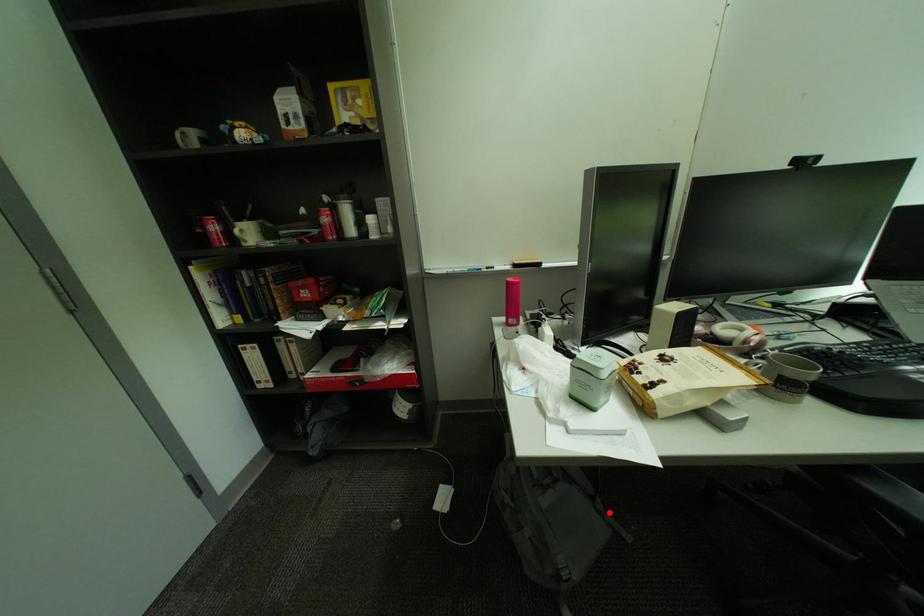
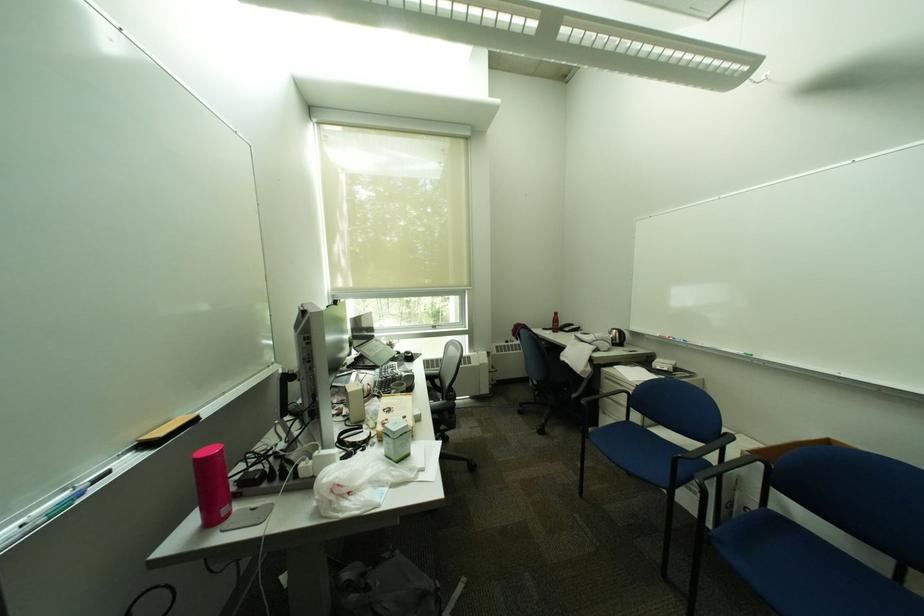
Question: I am providing you with two images of the same scene from different viewpoints. Given a red point in image1, look at the same physical point in image2. Is it:

Choices:
 (A) Closer to the viewpoint
 (B) Farther from the viewpoint

Answer: (A)